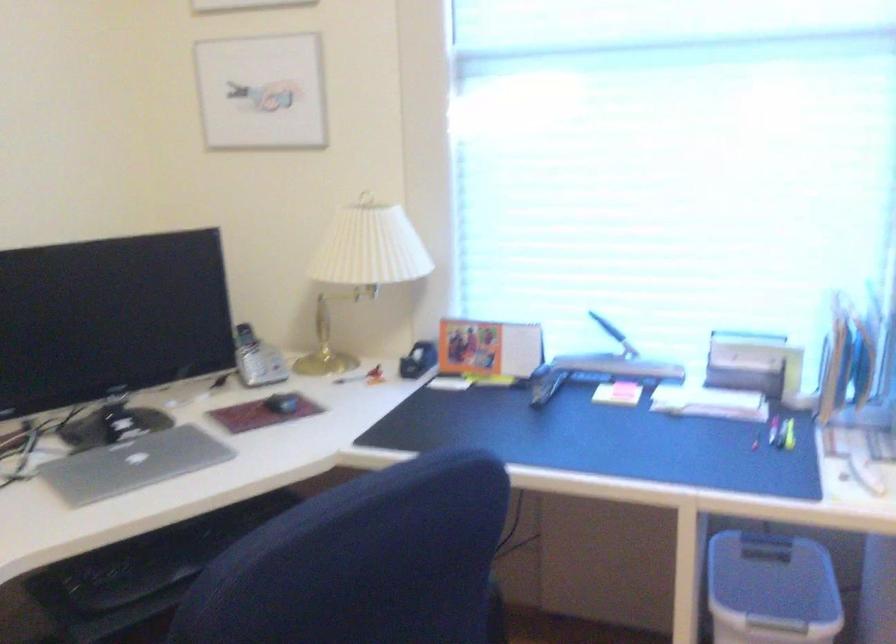
Find where to lift the silver cordless phone. Please return your answer as a coordinate pair (x, y).

(256, 359)